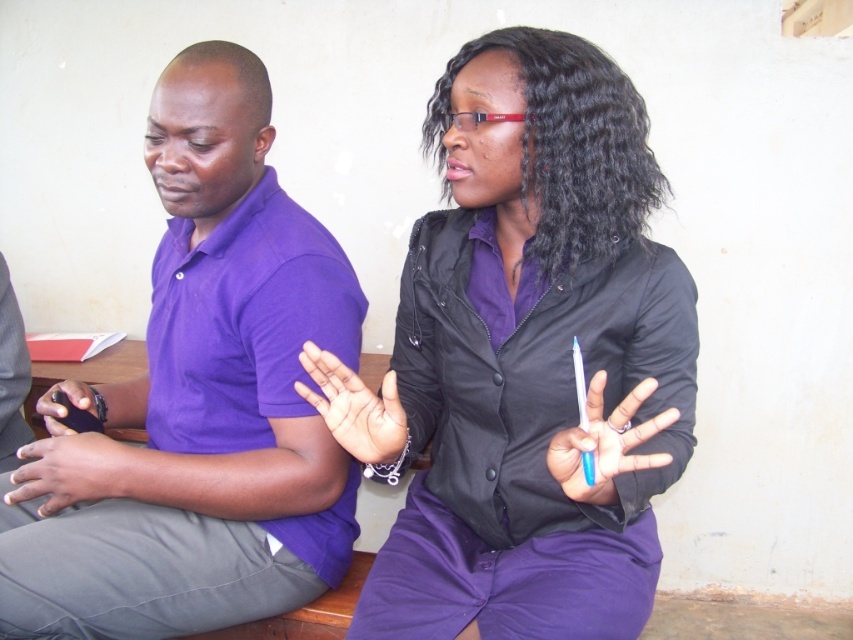
Between point (517, 28) and point (337, 384), which one is positioned in front?

Point (337, 384) is more forward.

Identify the location of matte black shirt at center. Image resolution: width=853 pixels, height=640 pixels. (526, 360).

What do you see at coordinates (526, 360) in the screenshot?
I see `matte black shirt at center` at bounding box center [526, 360].

At what (x,y) coordinates should I click in order to perform the action: click on matte black shirt at center. Please return your answer as a coordinate pair (x, y). Looking at the image, I should click on (526, 360).

Is point (331, 509) less distant than point (65, 396)?

Yes, point (331, 509) is closer to viewer.

Consider the image. Who is lower down, purple matte shirt at left or matte black phone at left?

matte black phone at left

The image size is (853, 640). What do you see at coordinates (206, 397) in the screenshot? I see `purple matte shirt at left` at bounding box center [206, 397].

The width and height of the screenshot is (853, 640). Identify the location of purple matte shirt at left. (206, 397).

Which of these two, smooth skin hand at center or matte black phone at left, stands taller?

smooth skin hand at center

Is smooth skin hand at center to the right of matte black phone at left from the viewer's perspective?

Indeed, smooth skin hand at center is positioned on the right side of matte black phone at left.

Measure the distance between point (373, 404) and camera.

Point (373, 404) is 37.83 inches from camera.

This screenshot has height=640, width=853. What are the coordinates of `smooth skin hand at center` in the screenshot? It's located at (354, 406).